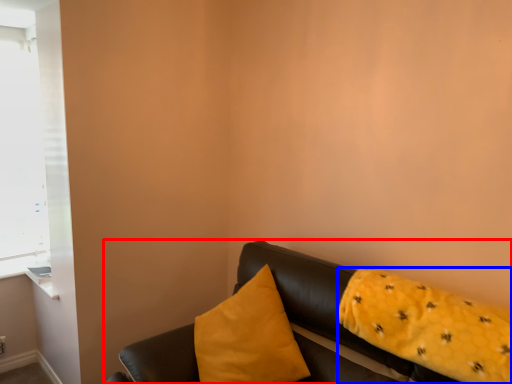
Question: Which object is closer to the camera taking this photo, studio couch (highlighted by a red box) or pillow (highlighted by a blue box)?

Choices:
 (A) studio couch
 (B) pillow

Answer: (A)